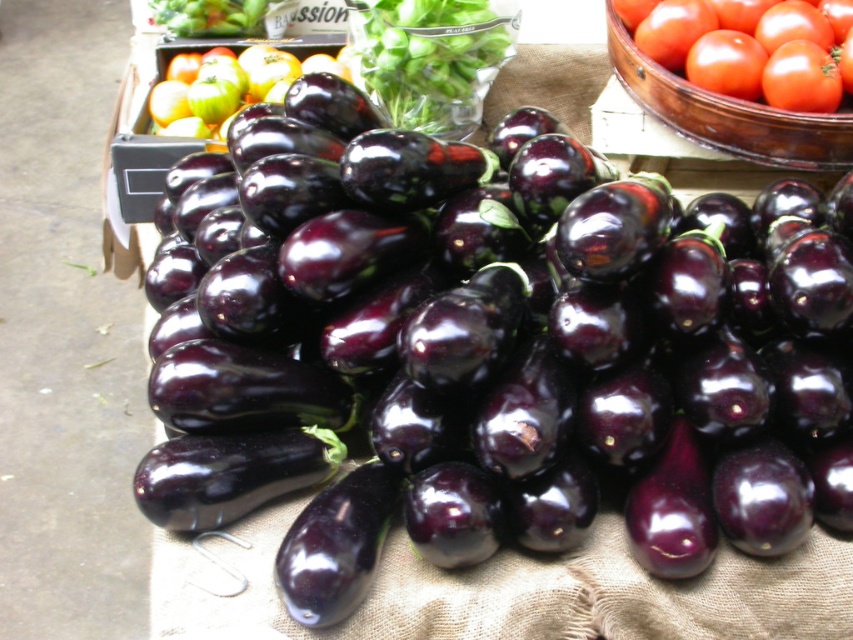
Question: Where is shiny purple eggplant at center located in relation to shiny green apples at upper left in the image?

Choices:
 (A) below
 (B) above

Answer: (A)

Question: Is glossy red tomato at upper right to the right of shiny green apples at upper left from the viewer's perspective?

Choices:
 (A) yes
 (B) no

Answer: (A)

Question: Which of the following is the farthest from the observer?

Choices:
 (A) (701, 307)
 (B) (178, 90)
 (C) (808, 104)

Answer: (B)

Question: Among these objects, which one is nearest to the camera?

Choices:
 (A) shiny green apples at upper left
 (B) shiny purple eggplant at center
 (C) glossy red tomato at upper right

Answer: (B)

Question: Does glossy red tomato at upper right appear over shiny green apples at upper left?

Choices:
 (A) no
 (B) yes

Answer: (A)

Question: Estimate the real-world distances between objects in this image. Which object is farther from the shiny purple eggplant at center?

Choices:
 (A) shiny green apples at upper left
 (B) glossy red tomato at upper right

Answer: (A)